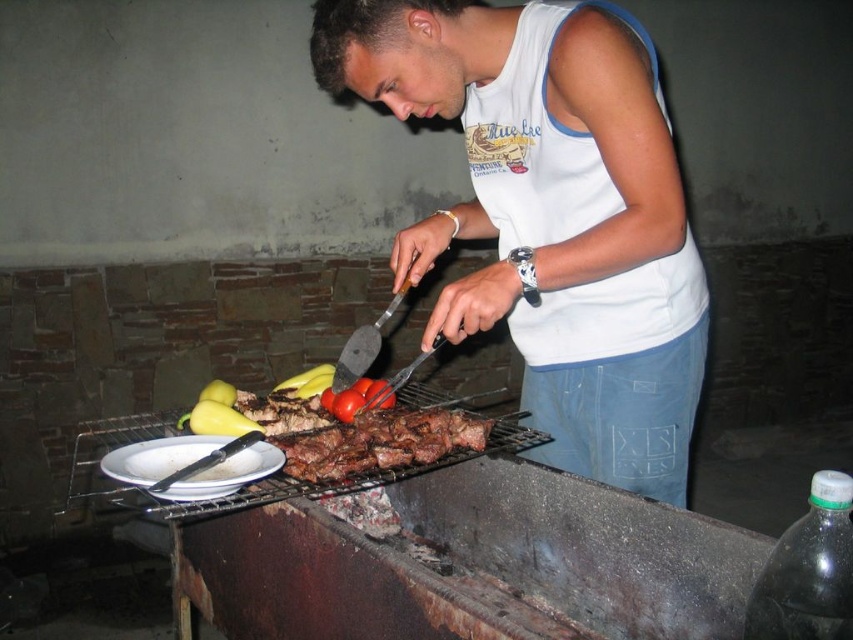
How far apart are metallic silver tong at lower left and yellow smooth pepper at lower left?

metallic silver tong at lower left and yellow smooth pepper at lower left are 25.41 inches apart.

Which of these two, metallic silver tong at lower left or yellow smooth pepper at lower left, stands shorter?

yellow smooth pepper at lower left

Is point (178, 474) positioned in front of point (287, 387)?

Yes, point (178, 474) is in front of point (287, 387).

Locate an element on the screen. The image size is (853, 640). metallic silver tong at lower left is located at coordinates (207, 460).

Is brown charred meat at center taller than yellow smooth pepper at lower left?

Yes.

Is brown charred meat at center thinner than yellow smooth pepper at lower left?

No.

Where is `brown charred meat at center`? This screenshot has width=853, height=640. brown charred meat at center is located at coordinates (379, 442).

The image size is (853, 640). Identify the location of brown charred meat at center. (379, 442).

Can you confirm if white cotton tank top at center is smaller than brown charred meat at center?

Incorrect, white cotton tank top at center is not smaller in size than brown charred meat at center.

What do you see at coordinates (550, 212) in the screenshot? I see `white cotton tank top at center` at bounding box center [550, 212].

Is point (447, 228) farther from camera compared to point (303, 444)?

That is True.

Locate an element on the screen. Image resolution: width=853 pixels, height=640 pixels. white cotton tank top at center is located at coordinates (550, 212).